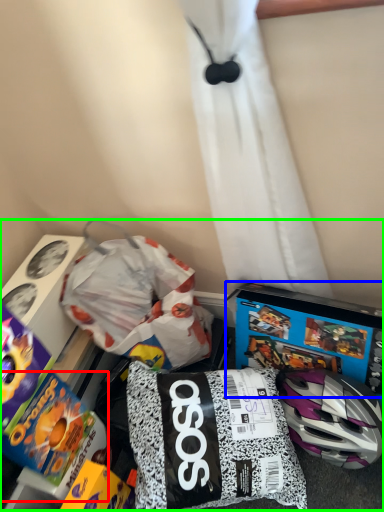
Question: Considering the real-world distances, which object is farthest from toy (highlighted by a red box)? video game (highlighted by a blue box) or toy (highlighted by a green box)?

Choices:
 (A) video game
 (B) toy

Answer: (A)